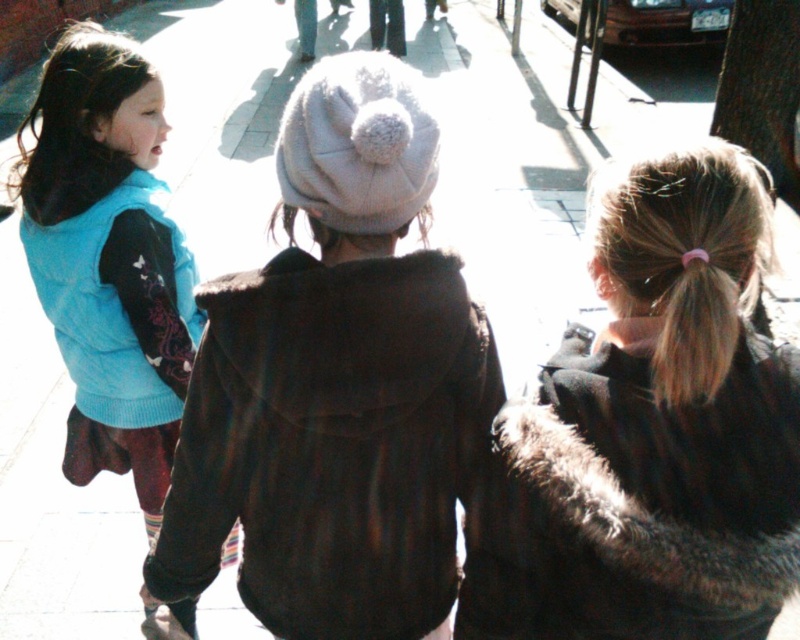
Question: Does blonde fur at upper right have a greater width compared to pink hair at center?

Choices:
 (A) yes
 (B) no

Answer: (A)

Question: Which object appears farthest from the camera in this image?

Choices:
 (A) blonde fur at upper right
 (B) pink hair at center
 (C) matte blue vest at left

Answer: (C)

Question: Is blonde fur at upper right below pink hair at center?

Choices:
 (A) yes
 (B) no

Answer: (A)

Question: Is dark brown fur coat at center bigger than pink hair at center?

Choices:
 (A) yes
 (B) no

Answer: (A)

Question: Based on their relative distances, which object is farther from the pink hair at center?

Choices:
 (A) blonde fur at upper right
 (B) dark brown fur coat at center
 (C) brown fur coat at center

Answer: (B)

Question: Which point appears closest to the camera in this image?

Choices:
 (A) (682, 348)
 (B) (282, 212)
 (C) (194, 515)

Answer: (A)